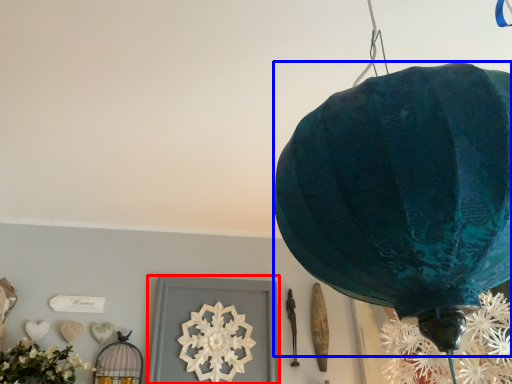
Question: Which of the following is the closest to the observer, picture frame (highlighted by a red box) or lantern (highlighted by a blue box)?

Choices:
 (A) picture frame
 (B) lantern

Answer: (B)